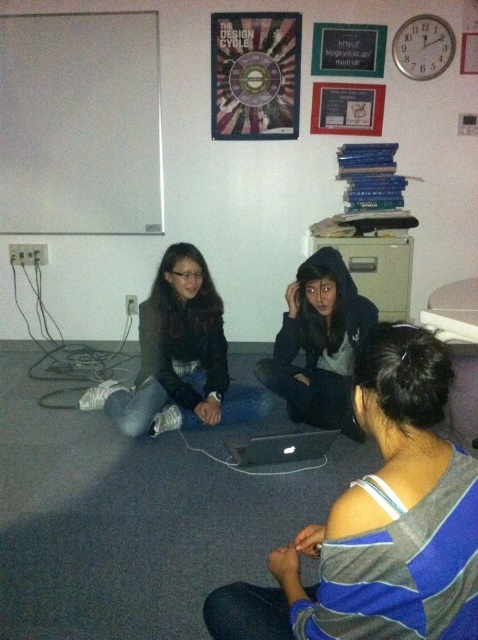
Question: Does matte black jacket at center have a lesser width compared to black hoodie at center?

Choices:
 (A) no
 (B) yes

Answer: (A)

Question: Can you confirm if matte black jacket at center is positioned below metallic circular object at upper center?

Choices:
 (A) yes
 (B) no

Answer: (A)

Question: Which of these objects is positioned farthest from the metallic circular object at upper center?

Choices:
 (A) matte black jacket at center
 (B) black hoodie at center
 (C) white matte board at upper left
 (D) gray striped shirt at lower right

Answer: (D)

Question: Which point appears closest to the camera in this image?

Choices:
 (A) (231, 84)
 (B) (292, 547)

Answer: (B)

Question: Considering the real-world distances, which object is farthest from the matte black jacket at center?

Choices:
 (A) black hoodie at center
 (B) white matte board at upper left

Answer: (B)

Question: Is gray striped shirt at lower right to the left of black hoodie at center from the viewer's perspective?

Choices:
 (A) no
 (B) yes

Answer: (B)